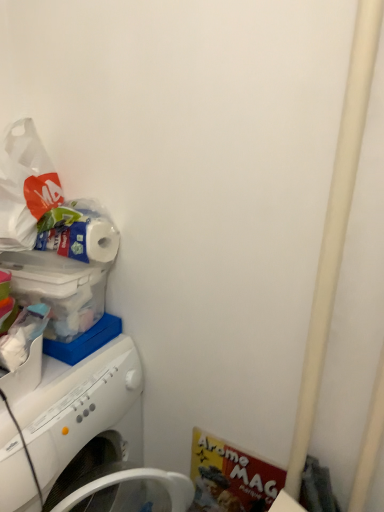
Describe the element at coordinates (79, 232) in the screenshot. The image size is (384, 512). I see `white matte toilet paper at upper left` at that location.

Locate an element on the screen. white matte toilet paper at upper left is located at coordinates (79, 232).

This screenshot has height=512, width=384. What do you see at coordinates (84, 410) in the screenshot? I see `white plastic washing machine at left` at bounding box center [84, 410].

Find the location of a particular element. white plastic washing machine at left is located at coordinates (84, 410).

I want to click on white matte toilet paper at upper left, so click(x=79, y=232).

Consider the image. Which is more to the left, white plastic washing machine at left or white matte toilet paper at upper left?

white plastic washing machine at left is more to the left.

Between white plastic washing machine at left and white matte toilet paper at upper left, which one is positioned in front?

white plastic washing machine at left is more forward.

Between point (67, 419) and point (74, 234), which one is positioned behind?

The point (74, 234) is farther from the camera.

From the image's perspective, who appears lower, white plastic washing machine at left or white matte toilet paper at upper left?

white plastic washing machine at left, from the image's perspective.

From a real-world perspective, does white plastic washing machine at left sit lower than white matte toilet paper at upper left?

Yes, from a real-world perspective, white plastic washing machine at left is below white matte toilet paper at upper left.

In terms of width, does white plastic washing machine at left look wider or thinner when compared to white matte toilet paper at upper left?

Considering their sizes, white plastic washing machine at left looks broader than white matte toilet paper at upper left.

Can you confirm if white plastic washing machine at left is taller than white matte toilet paper at upper left?

Yes, white plastic washing machine at left is taller than white matte toilet paper at upper left.

Based on the photo, considering the relative sizes of white plastic washing machine at left and white matte toilet paper at upper left in the image provided, is white plastic washing machine at left smaller than white matte toilet paper at upper left?

No, white plastic washing machine at left is not smaller than white matte toilet paper at upper left.

Consider the image. Is white plastic washing machine at left not within white matte toilet paper at upper left?

Indeed, white plastic washing machine at left is completely outside white matte toilet paper at upper left.

Is white plastic washing machine at left not near white matte toilet paper at upper left?

Actually, white plastic washing machine at left and white matte toilet paper at upper left are a little close together.

Is white plastic washing machine at left aimed at white matte toilet paper at upper left?

No, white plastic washing machine at left does not turn towards white matte toilet paper at upper left.

In the scene shown: Measure the distance from white plastic washing machine at left to white matte toilet paper at upper left.

white plastic washing machine at left is 16.68 inches from white matte toilet paper at upper left.

Locate an element on the screen. washing machine below the white matte toilet paper at upper left (from the image's perspective) is located at coordinates (84, 410).

Can you confirm if white matte toilet paper at upper left is positioned to the right of white plastic washing machine at left?

Yes, white matte toilet paper at upper left is to the right of white plastic washing machine at left.

Does white matte toilet paper at upper left come behind white plastic washing machine at left?

That is True.

Is point (88, 262) closer to camera compared to point (84, 414)?

No, (88, 262) is further to viewer.

From the image's perspective, is white matte toilet paper at upper left under white plastic washing machine at left?

No, from the image's perspective, white matte toilet paper at upper left is not below white plastic washing machine at left.

From a real-world perspective, who is located higher, white matte toilet paper at upper left or white plastic washing machine at left?

From a 3D spatial view, white matte toilet paper at upper left is above.

Considering the sizes of objects white matte toilet paper at upper left and white plastic washing machine at left in the image provided, who is wider, white matte toilet paper at upper left or white plastic washing machine at left?

white plastic washing machine at left.

Considering the sizes of objects white matte toilet paper at upper left and white plastic washing machine at left in the image provided, who is taller, white matte toilet paper at upper left or white plastic washing machine at left?

With more height is white plastic washing machine at left.

Who is bigger, white matte toilet paper at upper left or white plastic washing machine at left?

white plastic washing machine at left is bigger.

Is white plastic washing machine at left completely or partially inside white matte toilet paper at upper left?

Definitely not — white plastic washing machine at left is not inside white matte toilet paper at upper left.

Is white matte toilet paper at upper left far from white plastic washing machine at left?

Actually, white matte toilet paper at upper left and white plastic washing machine at left are a little close together.

Is white matte toilet paper at upper left looking in the opposite direction of white plastic washing machine at left?

white matte toilet paper at upper left does not have its back to white plastic washing machine at left.

Can you tell me how much white matte toilet paper at upper left and white plastic washing machine at left differ in facing direction?

0.000845 degrees.

Find the location of `toilet paper that appears above the white plastic washing machine at left (from the image's perspective)`. toilet paper that appears above the white plastic washing machine at left (from the image's perspective) is located at coordinates (79, 232).

Identify the location of washing machine below the white matte toilet paper at upper left (from a real-world perspective). The height and width of the screenshot is (512, 384). (84, 410).

Find the location of `toilet paper on the right side of white plastic washing machine at left`. toilet paper on the right side of white plastic washing machine at left is located at coordinates (79, 232).